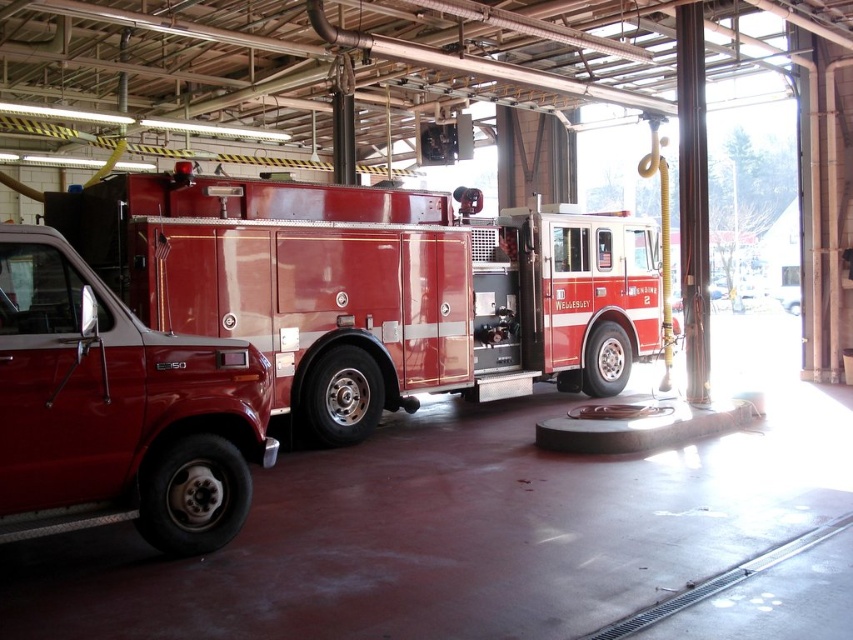
Question: Is shiny red fire truck at center thinner than rubber/smooth tire at center?

Choices:
 (A) yes
 (B) no

Answer: (B)

Question: Does shiny silver tire at center come behind rubber/smooth tire at center?

Choices:
 (A) no
 (B) yes

Answer: (A)

Question: Is shiny red fire truck at center to the left of rubber/smooth tire at center from the viewer's perspective?

Choices:
 (A) yes
 (B) no

Answer: (A)

Question: Which object is farther from the camera taking this photo?

Choices:
 (A) rubber/smooth tire at center
 (B) shiny silver tire at center

Answer: (A)

Question: Among these objects, which one is farthest from the camera?

Choices:
 (A) black rubber tire at lower left
 (B) shiny silver tire at center
 (C) shiny red fire truck at center

Answer: (B)

Question: Considering the real-world distances, which object is closest to the shiny silver tire at center?

Choices:
 (A) black rubber tire at lower left
 (B) rubber/smooth tire at center

Answer: (A)